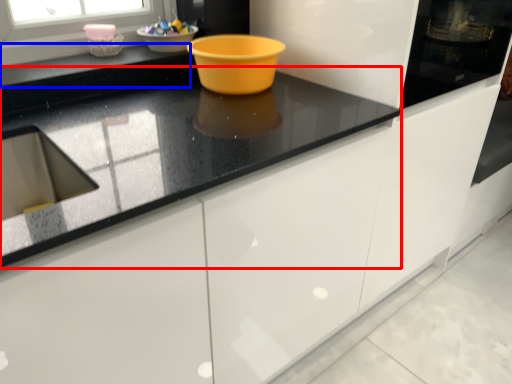
Question: Which of the following is the closest to the observer, countertop (highlighted by a red box) or counter top (highlighted by a blue box)?

Choices:
 (A) countertop
 (B) counter top

Answer: (A)